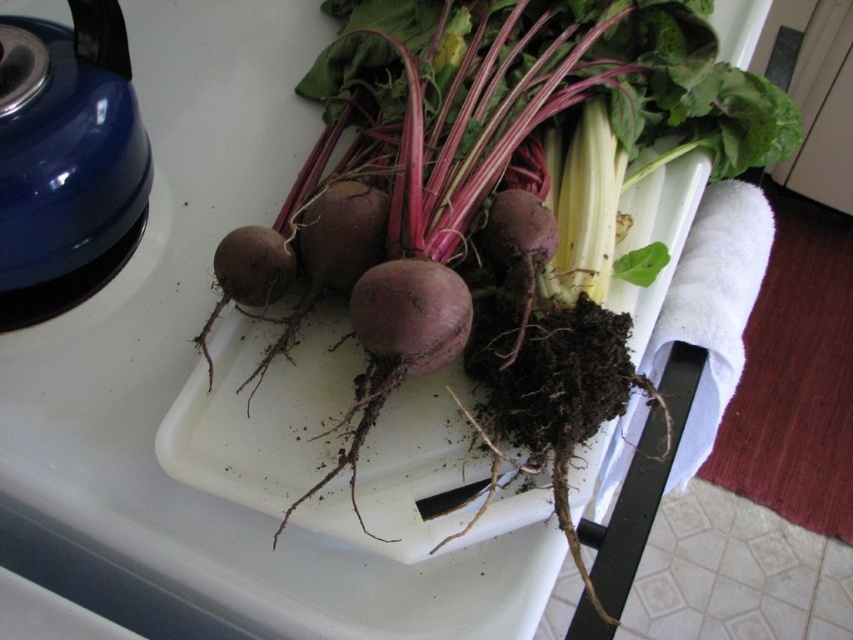
Is point (436, 88) positioned after point (10, 209)?

Yes, it is behind point (10, 209).

Between purple matte beetroot at center and blue glossy kettle at upper left, which one appears on the right side from the viewer's perspective?

From the viewer's perspective, purple matte beetroot at center appears more on the right side.

Find the location of `purple matte beetroot at center`. purple matte beetroot at center is located at coordinates (492, 189).